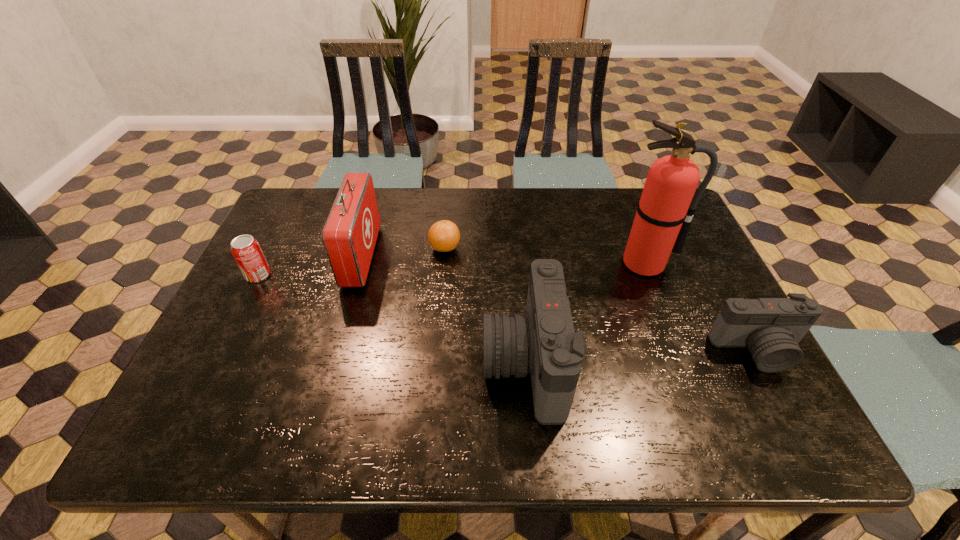
Where is `free space between the soda can and the first-aid kit`? Image resolution: width=960 pixels, height=540 pixels. free space between the soda can and the first-aid kit is located at coordinates (310, 266).

Where is `blank region between the orange and the fourth shortest object`? This screenshot has height=540, width=960. blank region between the orange and the fourth shortest object is located at coordinates (485, 306).

The height and width of the screenshot is (540, 960). I want to click on blank region between the fire extinguisher and the orange, so click(x=545, y=256).

You are a GUI agent. You are given a task and a screenshot of the screen. Output one action in this format:
    pyautogui.click(x=<x>, y=<y>)
    Task: Click on the free space between the third tallest object and the leftmost object
    
    Given the screenshot: What is the action you would take?
    pyautogui.click(x=392, y=319)

Locate an element on the screen. This screenshot has width=960, height=540. vacant space that's between the leftmost object and the second object from left to right is located at coordinates (310, 266).

Locate an element on the screen. object that is the second closest one to the tallest object is located at coordinates (543, 342).

Identify which object is the closest to the fourth object from right to left. Please provide its 2D coordinates. Your answer should be formatted as a tuple, i.e. [(x, y)], where the tuple contains the x and y coordinates of a point satisfying the conditions above.

[(350, 233)]

Locate an element on the screen. vacant area in the image that satisfies the following two spatial constraints: 1. at the lens of the right camera; 2. at the lens of the left camera is located at coordinates (764, 363).